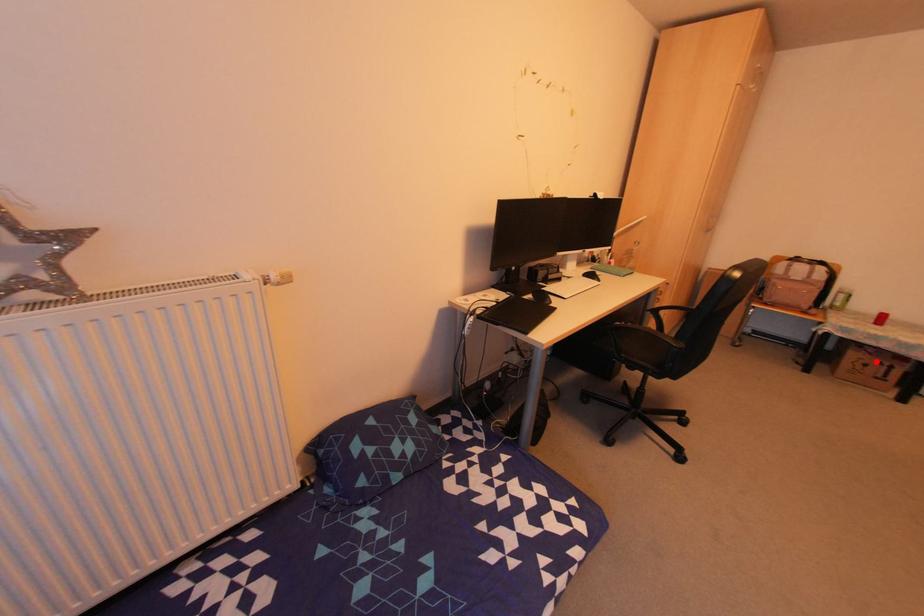
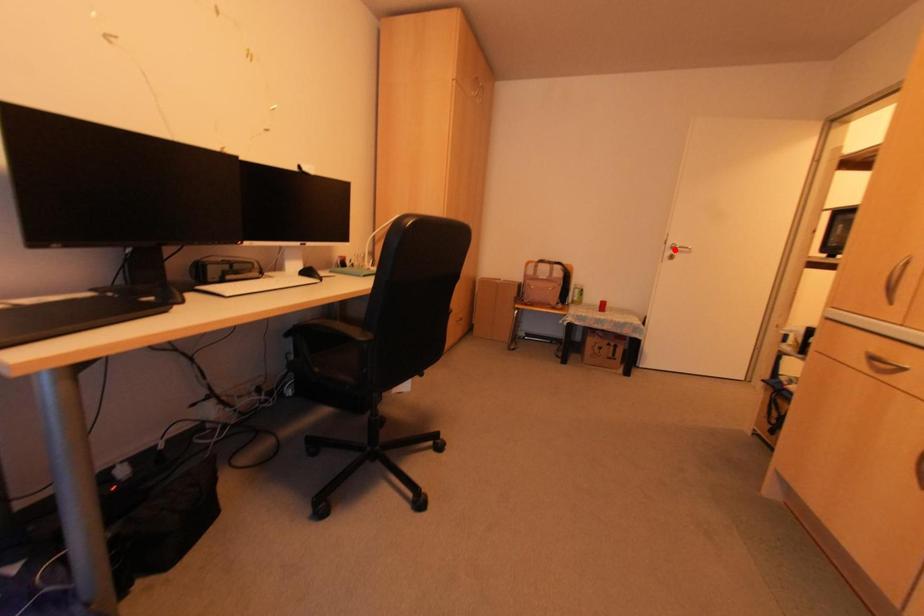
I am providing you with two images of the same scene from different viewpoints. A red point is marked on the first image and another point is marked on the second image. Does the point marked in image1 correspond to the same location as the one in image2?

No